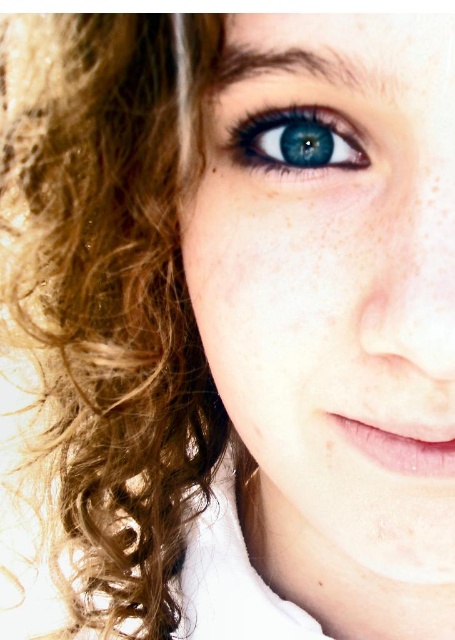
You are a photographer adjusting the focus on a camera. You have two points to consider in the image of a person. The first point is at coordinates point (387,225) and the second is at point (323,586). Which point should you focus on to ensure the subject is sharp if you want the foreground to be in focus?

Point (387,225) should be focused on because it is in front of point (323,586), making it closer to the camera and thus the foreground.

Based on the provided scene description, what is the exact coordinate of the smooth skin face at center?

The smooth skin face at center is located at point (x=337, y=275).